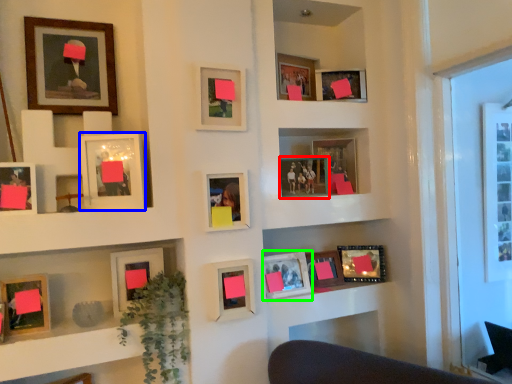
Question: Considering the real-world distances, which object is farthest from picture frame (highlighted by a red box)? picture frame (highlighted by a blue box) or picture frame (highlighted by a green box)?

Choices:
 (A) picture frame
 (B) picture frame

Answer: (A)